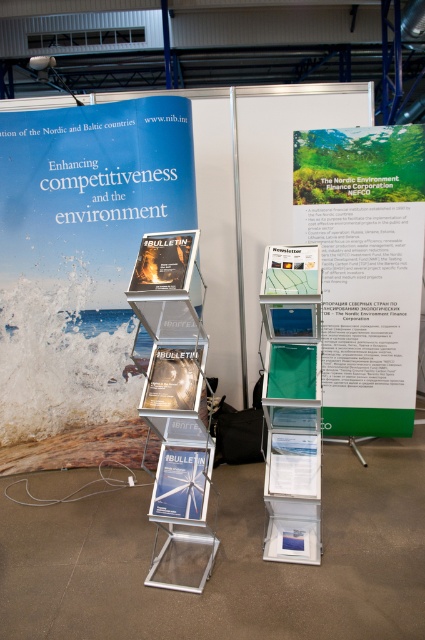
Is point (180, 513) positioned before point (152, 243)?

That is False.

Who is taller, matte white poster at center or matte plastic bulletin at center?

With more height is matte white poster at center.

Where is `matte white poster at center`? matte white poster at center is located at coordinates (181, 483).

Is green paper at upper right wider than green glossy newsletter at center?

Yes, green paper at upper right is wider than green glossy newsletter at center.

Can you confirm if green paper at upper right is smaller than green glossy newsletter at center?

Incorrect, green paper at upper right is not smaller in size than green glossy newsletter at center.

Image resolution: width=425 pixels, height=640 pixels. Describe the element at coordinates (365, 268) in the screenshot. I see `green paper at upper right` at that location.

You are a GUI agent. You are given a task and a screenshot of the screen. Output one action in this format:
    pyautogui.click(x=<x>, y=<y>)
    Task: Click on the green paper at upper right
    
    Given the screenshot: What is the action you would take?
    pyautogui.click(x=365, y=268)

Can you confirm if blue paper poster at center is positioned to the right of green glossy newsletter at center?

Incorrect, blue paper poster at center is not on the right side of green glossy newsletter at center.

Does blue paper poster at center have a lesser height compared to green glossy newsletter at center?

In fact, blue paper poster at center may be taller than green glossy newsletter at center.

The width and height of the screenshot is (425, 640). Identify the location of blue paper poster at center. (93, 189).